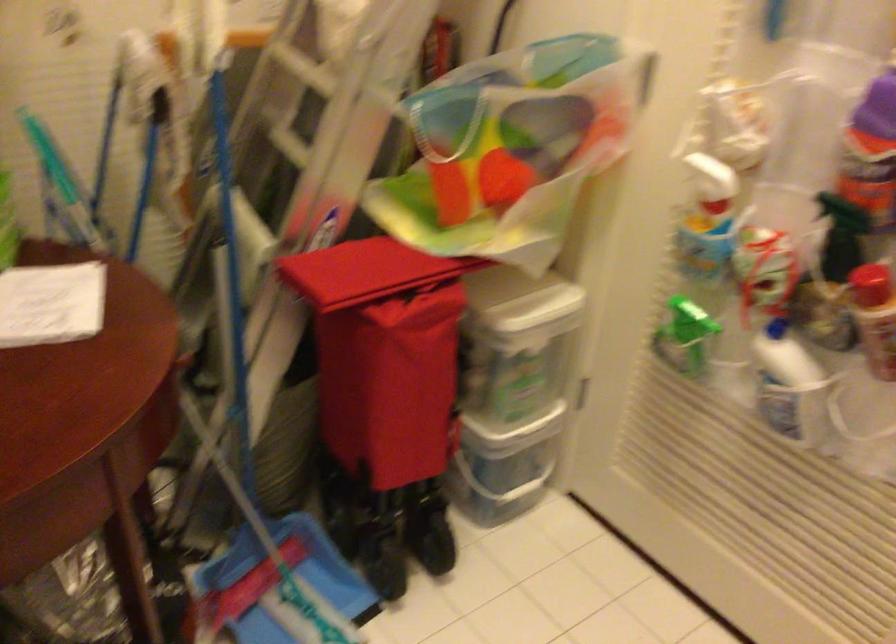
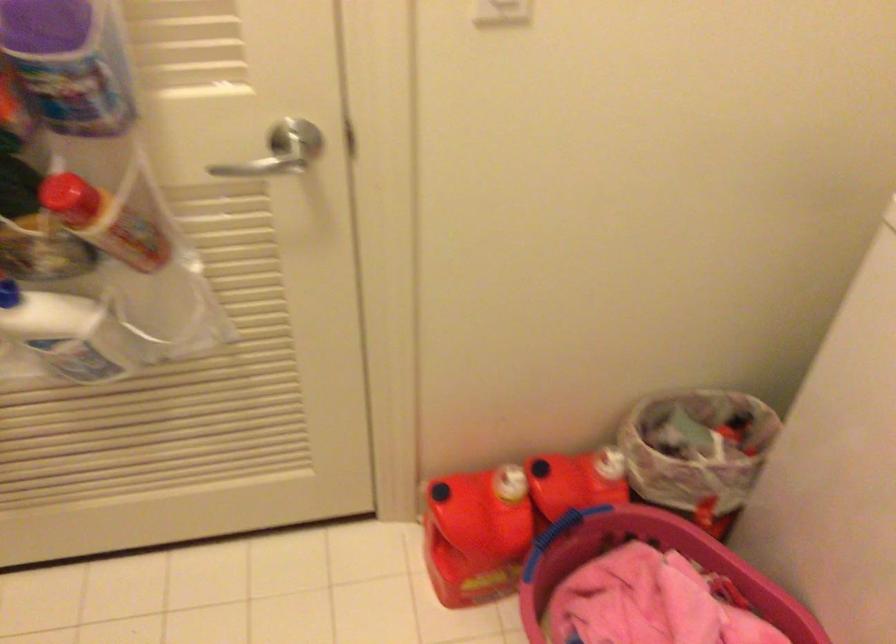
Based on the photo, the first image is from the beginning of the video and the second image is from the end. How did the camera likely rotate when shooting the video?

The camera's rotation is toward right-down.